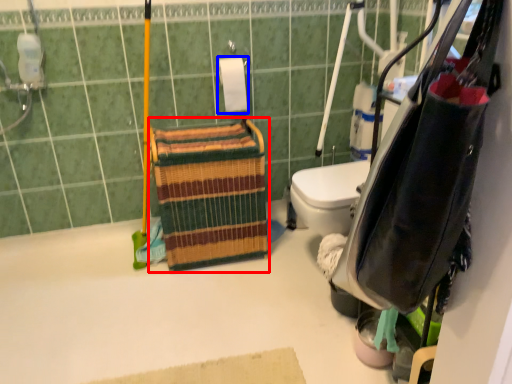
Question: Among these objects, which one is farthest to the camera, basket (highlighted by a red box) or toilet paper (highlighted by a blue box)?

Choices:
 (A) basket
 (B) toilet paper

Answer: (B)